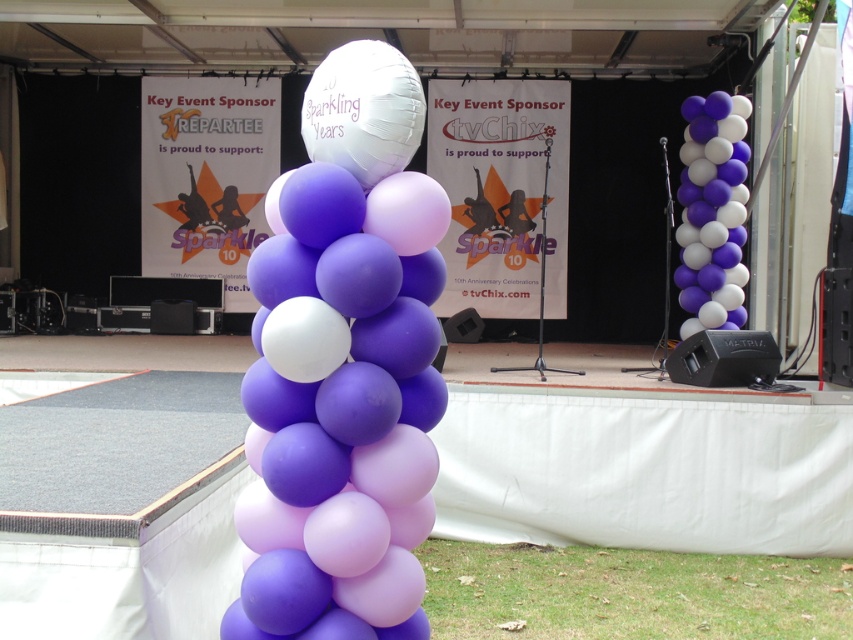
Based on the photo, you are organizing a party and need to arrange balloons. You have two sets of purple balloons at the event venue. The first set is labeled as matte purple balloons at center, and the second set is called purple matte balloons at right. Which set has larger balloons?

The purple matte balloons at right are larger than the matte purple balloons at center.

You are an event planner standing at the back of the stage. You need to move a large table to the front. There are two groups of balloons present. Which group of balloons, the matte purple balloons at center or the purple matte balloons at right, should you move first to make space?

The matte purple balloons at center should be moved first since it is in front of the purple matte balloons at right, meaning it is closer to you at the back of the stage and needs to be relocated before accessing the ones behind.